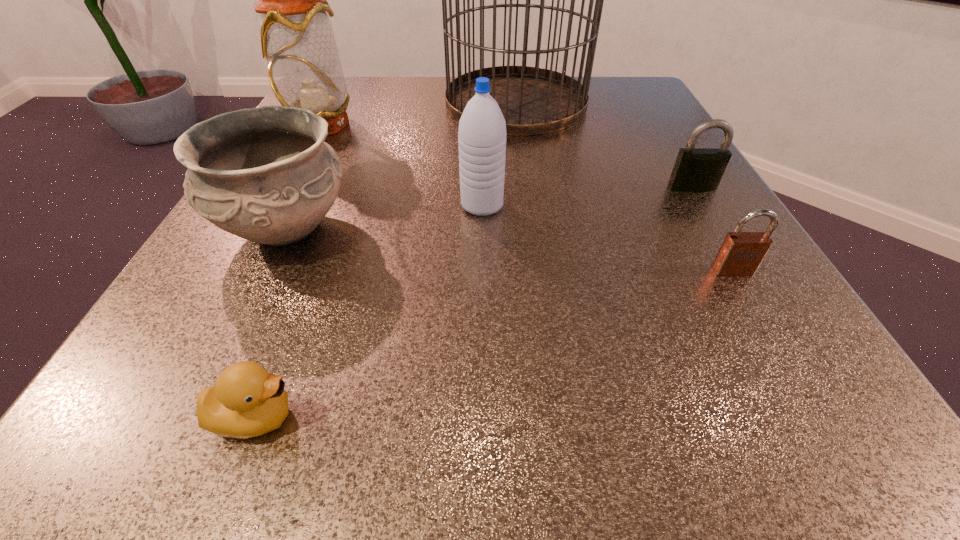
Locate an element on the screen. This screenshot has height=540, width=960. oil lamp present at the left edge is located at coordinates (297, 39).

Identify the location of pottery that is positioned at the left edge. (265, 174).

Locate an element on the screen. Image resolution: width=960 pixels, height=540 pixels. duckling that is at the left edge is located at coordinates (247, 401).

You are a GUI agent. You are given a task and a screenshot of the screen. Output one action in this format:
    pyautogui.click(x=<x>, y=<y>)
    Task: Click on the birdcage located at the right edge
    Image resolution: width=960 pixels, height=540 pixels.
    Given the screenshot: What is the action you would take?
    pyautogui.click(x=533, y=100)

I want to click on object at the far left corner, so click(x=297, y=39).

Find the location of a particular element. This screenshot has width=960, height=540. object that is at the near left corner is located at coordinates (247, 401).

What are the coordinates of `object that is positioned at the far right corner` in the screenshot? It's located at (533, 100).

You are a GUI agent. You are given a task and a screenshot of the screen. Output one action in this format:
    pyautogui.click(x=<x>, y=<y>)
    Task: Click on the free space at the far edge of the desktop
    The image size is (960, 540).
    Given the screenshot: What is the action you would take?
    (x=414, y=118)

The height and width of the screenshot is (540, 960). In order to click on vacant region at the near edge in this screenshot , I will do `click(665, 406)`.

Identify the location of free space at the left edge of the desktop. (240, 322).